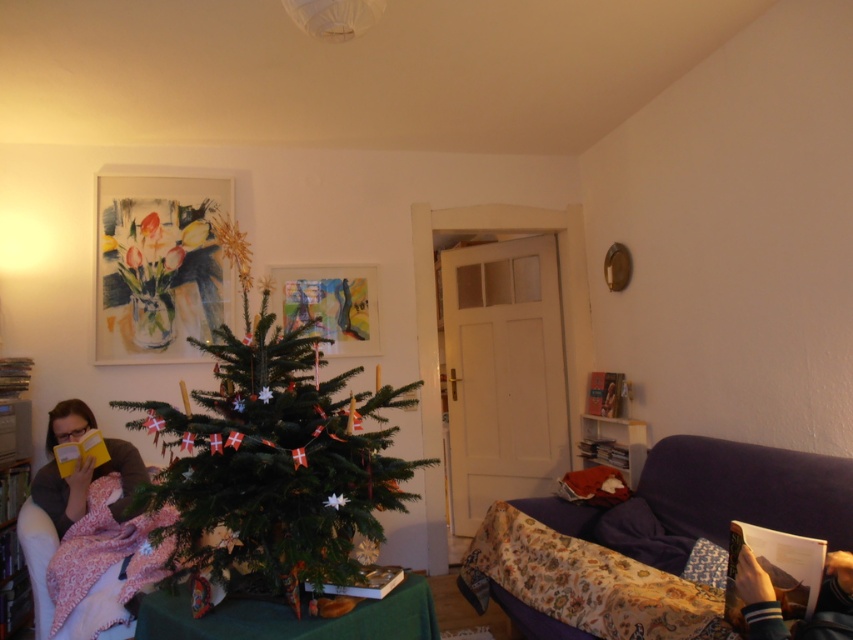
Question: Which of the following is the closest to the observer?

Choices:
 (A) (759, 467)
 (B) (65, 524)
 (C) (286, 532)

Answer: (C)

Question: Is green matte christmas tree at center above purple fabric couch at lower right?

Choices:
 (A) no
 (B) yes

Answer: (B)

Question: Is purple fabric couch at lower right positioned behind matte yellow book at left?

Choices:
 (A) no
 (B) yes

Answer: (A)

Question: Which object is farther from the camera taking this photo?

Choices:
 (A) matte yellow book at left
 (B) purple fabric couch at lower right

Answer: (A)

Question: Can you confirm if green matte christmas tree at center is positioned to the right of purple fabric couch at lower right?

Choices:
 (A) yes
 (B) no

Answer: (B)

Question: Considering the real-world distances, which object is farthest from the matte yellow book at left?

Choices:
 (A) green matte christmas tree at center
 (B) purple fabric couch at lower right

Answer: (B)